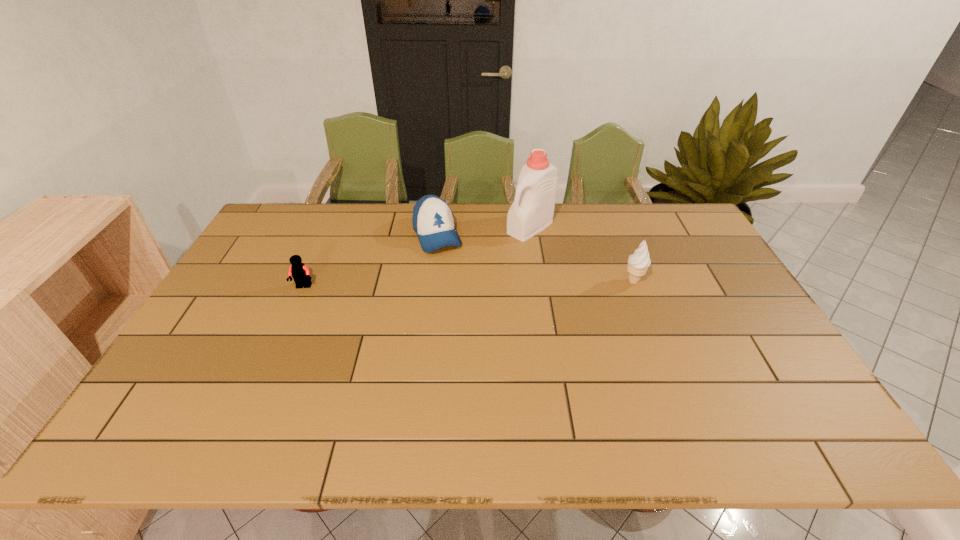
You are a GUI agent. You are given a task and a screenshot of the screen. Output one action in this format:
    pyautogui.click(x=<x>, y=<y>)
    Task: Click on the free location at the right edge of the desktop
    The width and height of the screenshot is (960, 540).
    Given the screenshot: What is the action you would take?
    pyautogui.click(x=689, y=275)

The height and width of the screenshot is (540, 960). In the image, there is a desktop. What are the coordinates of `free space at the far left corner` in the screenshot? It's located at (274, 226).

Find the location of a particular element. free area in between the rightmost object and the Lego is located at coordinates (468, 284).

The image size is (960, 540). What are the coordinates of `free space between the third object from left to right and the second object from left to right` in the screenshot? It's located at (484, 231).

Where is `blank region between the leftmost object and the third object from right to left`? The width and height of the screenshot is (960, 540). blank region between the leftmost object and the third object from right to left is located at coordinates (371, 261).

The image size is (960, 540). In order to click on vacant area that lies between the tallest object and the leftmost object in this screenshot , I will do `click(417, 257)`.

At what (x,y) coordinates should I click in order to perform the action: click on unoccupied position between the tallest object and the Lego. Please return your answer as a coordinate pair (x, y). Looking at the image, I should click on (417, 257).

This screenshot has height=540, width=960. In order to click on unoccupied area between the detergent and the third object from right to left in this screenshot , I will do `click(484, 231)`.

Find the location of a particular element. The image size is (960, 540). free space between the third shortest object and the baseball cap is located at coordinates (535, 258).

Find the location of a particular element. This screenshot has height=540, width=960. unoccupied area between the Lego and the detergent is located at coordinates (417, 257).